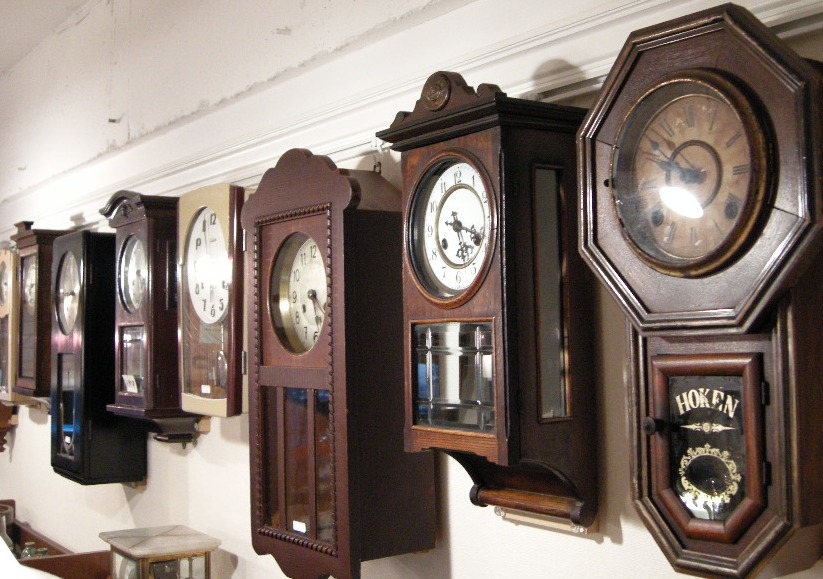
Identify the location of clock face. (707, 197), (448, 234), (294, 285), (210, 267), (135, 281), (70, 294), (31, 288), (7, 287).